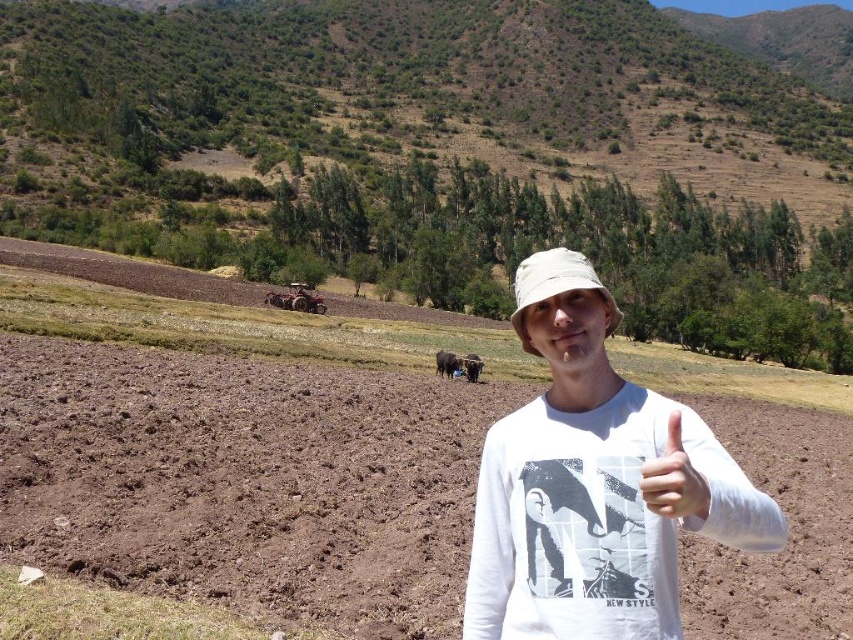
Question: Which point appears farthest from the camera in this image?

Choices:
 (A) (448, 365)
 (B) (654, 472)

Answer: (A)

Question: Which point is farther from the camera taking this photo?

Choices:
 (A) (450, 369)
 (B) (640, 470)

Answer: (A)

Question: Which of these objects is positioned farthest from the brown soil at center?

Choices:
 (A) brown fuzzy cow at center
 (B) white cotton shirt at center

Answer: (B)

Question: Is white fabric hat at center below white matte hand at center?

Choices:
 (A) yes
 (B) no

Answer: (B)

Question: Is white fabric hat at center to the left of black fur at center from the viewer's perspective?

Choices:
 (A) yes
 (B) no

Answer: (B)

Question: Is white cotton shirt at center positioned at the back of black fur at center?

Choices:
 (A) yes
 (B) no

Answer: (B)